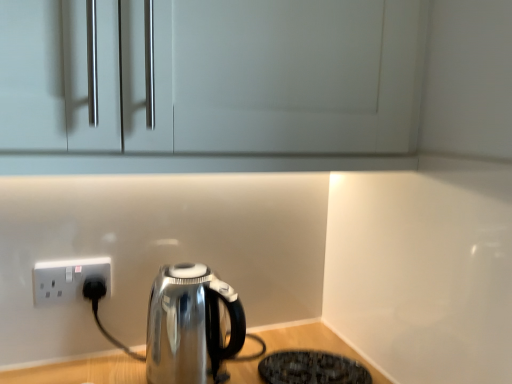
Question: Does white plastic socket at lower left have a larger size compared to black textured mat at lower right?

Choices:
 (A) no
 (B) yes

Answer: (A)

Question: From a real-world perspective, is white plastic socket at lower left located higher than black textured mat at lower right?

Choices:
 (A) yes
 (B) no

Answer: (A)

Question: Does white plastic socket at lower left appear on the right side of black textured mat at lower right?

Choices:
 (A) yes
 (B) no

Answer: (B)

Question: Is black textured mat at lower right at the back of white plastic socket at lower left?

Choices:
 (A) yes
 (B) no

Answer: (B)

Question: Considering the relative sizes of white plastic socket at lower left and black textured mat at lower right in the image provided, is white plastic socket at lower left shorter than black textured mat at lower right?

Choices:
 (A) yes
 (B) no

Answer: (B)

Question: Can you confirm if white plastic socket at lower left is positioned to the left of black textured mat at lower right?

Choices:
 (A) yes
 (B) no

Answer: (A)

Question: Does shiny metallic kettle at lower left have a smaller size compared to white plastic socket at lower left?

Choices:
 (A) no
 (B) yes

Answer: (A)

Question: Does shiny metallic kettle at lower left have a lesser height compared to white plastic socket at lower left?

Choices:
 (A) no
 (B) yes

Answer: (A)

Question: Is shiny metallic kettle at lower left closer to camera compared to white plastic socket at lower left?

Choices:
 (A) yes
 (B) no

Answer: (A)

Question: Is shiny metallic kettle at lower left directly adjacent to white plastic socket at lower left?

Choices:
 (A) no
 (B) yes

Answer: (A)

Question: Would you say shiny metallic kettle at lower left is a long distance from white plastic socket at lower left?

Choices:
 (A) yes
 (B) no

Answer: (B)

Question: Considering the relative sizes of shiny metallic kettle at lower left and white plastic socket at lower left in the image provided, is shiny metallic kettle at lower left wider than white plastic socket at lower left?

Choices:
 (A) yes
 (B) no

Answer: (A)

Question: Considering the relative positions of shiny metallic kettle at lower left and black textured mat at lower right in the image provided, is shiny metallic kettle at lower left to the right of black textured mat at lower right from the viewer's perspective?

Choices:
 (A) yes
 (B) no

Answer: (B)